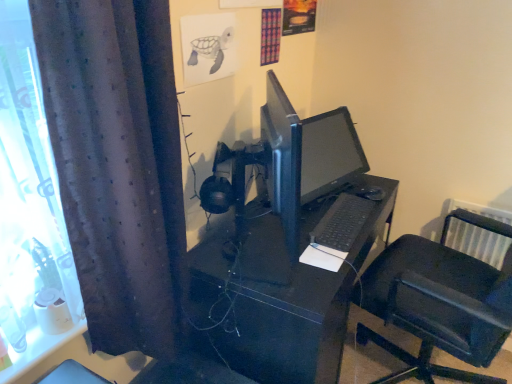
You are a GUI agent. You are given a task and a screenshot of the screen. Output one action in this format:
    pyautogui.click(x=<x>, y=<y>)
    Task: Click on the free region on the left part of black matte keyboard at center
    The image size is (512, 384).
    Given the screenshot: What is the action you would take?
    pyautogui.click(x=272, y=221)